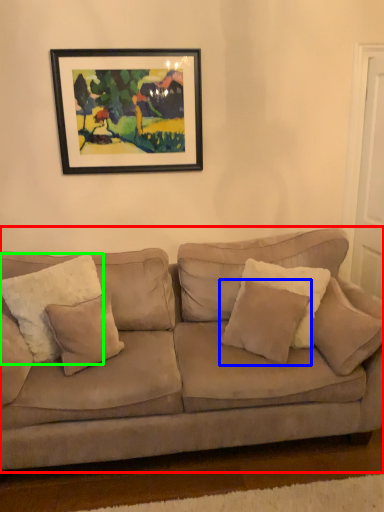
Question: Estimate the real-world distances between objects in this image. Which object is farther from studio couch (highlighted by a red box), pillow (highlighted by a blue box) or pillow (highlighted by a green box)?

Choices:
 (A) pillow
 (B) pillow

Answer: (B)